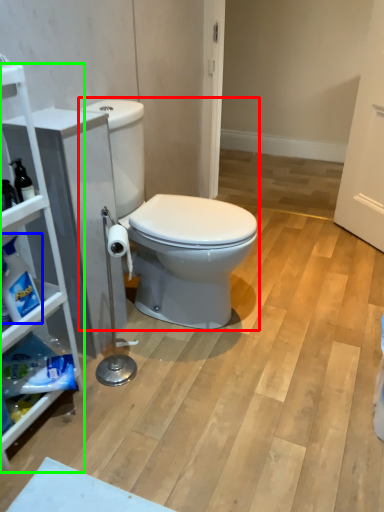
Question: Estimate the real-world distances between objects in this image. Which object is closer to toilet (highlighted by a red box), cleaning product (highlighted by a blue box) or cabinetry (highlighted by a green box)?

Choices:
 (A) cleaning product
 (B) cabinetry

Answer: (B)